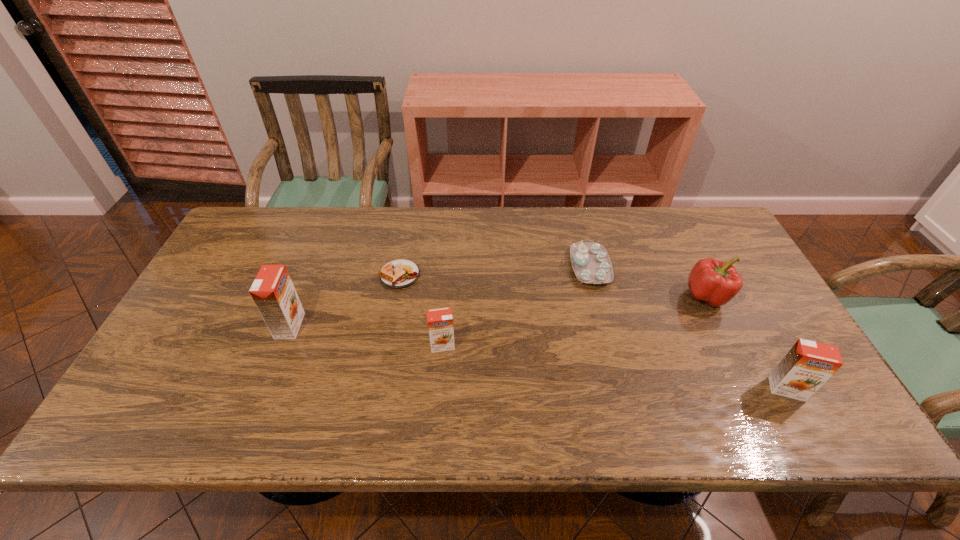
This screenshot has width=960, height=540. Find the location of `bell pepper at the right edge`. bell pepper at the right edge is located at coordinates (715, 282).

Identify the location of object at the near right corner. The width and height of the screenshot is (960, 540). (807, 366).

The height and width of the screenshot is (540, 960). What are the coordinates of `free spot at the far edge of the desktop` in the screenshot? It's located at (493, 244).

The image size is (960, 540). In order to click on vacant space at the left edge in this screenshot , I will do click(x=238, y=310).

Where is `free space at the right edge`? The image size is (960, 540). free space at the right edge is located at coordinates (752, 291).

This screenshot has width=960, height=540. In the image, there is a desktop. Identify the location of vacant area at the far left corner. (284, 220).

Where is `vacant region at the far right corner of the desktop`? The image size is (960, 540). vacant region at the far right corner of the desktop is located at coordinates (702, 247).

You are a GUI agent. You are given a task and a screenshot of the screen. Output one action in this format:
    pyautogui.click(x=<x>, y=<y>)
    Task: Click on the free space at the near right corner
    Image resolution: width=960 pixels, height=540 pixels.
    Given the screenshot: What is the action you would take?
    pyautogui.click(x=752, y=391)

Locate an element on the screen. Image resolution: width=960 pixels, height=540 pixels. free space between the bell pepper and the fifth shortest object is located at coordinates (747, 342).

At what (x,y) coordinates should I click in order to perform the action: click on vacant space in between the second shortest orange juice and the chinaware. Please return your answer as a coordinate pair (x, y). This screenshot has width=960, height=540. Looking at the image, I should click on (688, 328).